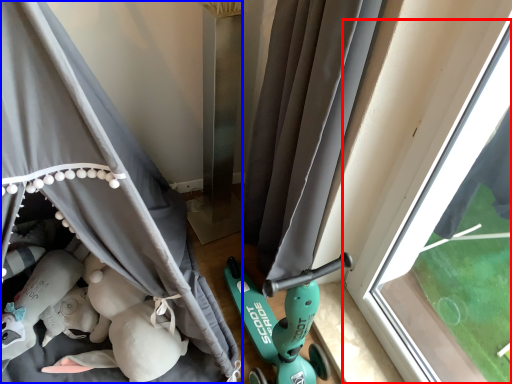
Question: Which object is further to the camera taking this photo, window (highlighted by a red box) or curtain (highlighted by a blue box)?

Choices:
 (A) window
 (B) curtain

Answer: (A)